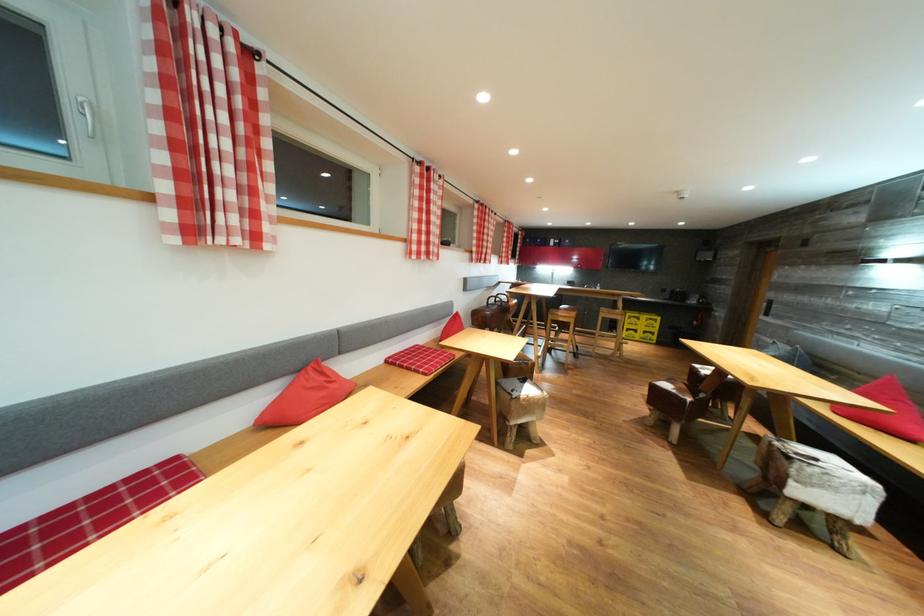
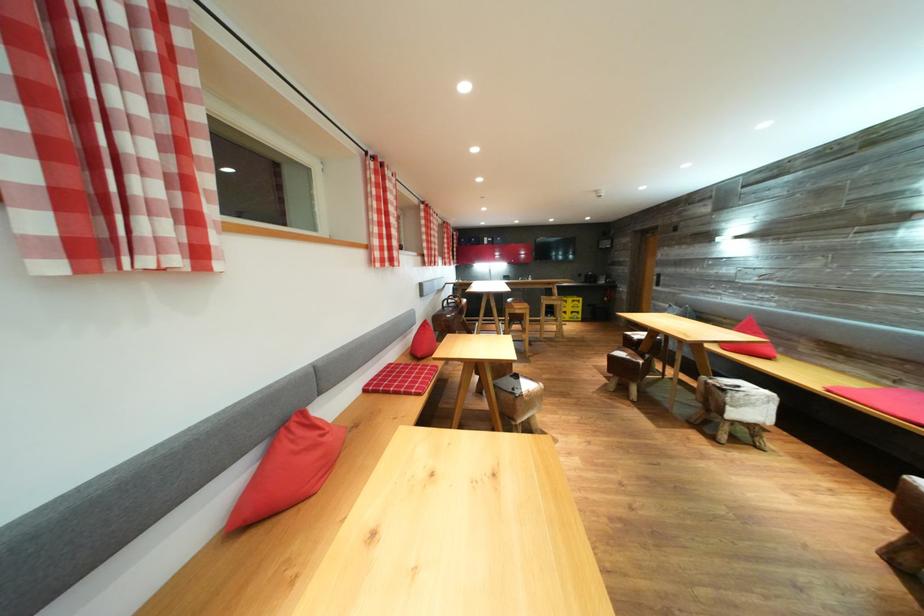
Locate, in the second image, the point that corresponds to pixel 227 246 in the first image.

(153, 267)